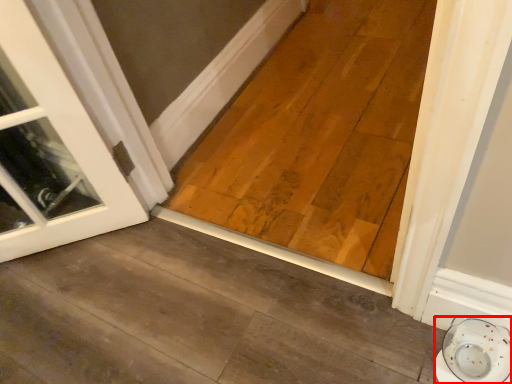
Question: Considering the relative positions of saucer (annotated by the red box) and plank in the image provided, where is saucer (annotated by the red box) located with respect to the staircase?

Choices:
 (A) left
 (B) right

Answer: (B)